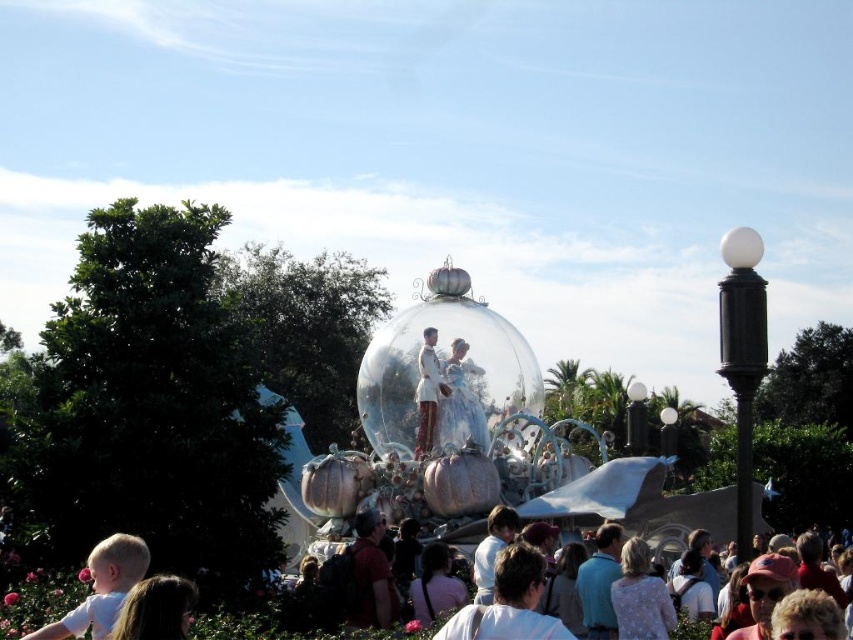
Who is more forward, (524,588) or (181,580)?

Point (181,580) is in front.

Can you confirm if white cotton shirt at center is positioned above blonde hair at lower left?

Incorrect, white cotton shirt at center is not positioned above blonde hair at lower left.

Locate an element on the screen. This screenshot has height=640, width=853. white cotton shirt at center is located at coordinates (508, 604).

Between point (486, 605) and point (425, 333), which one is positioned behind?

The point (425, 333) is more distant.

Based on the photo, who is more forward, (498,605) or (422,349)?

Point (498,605) is more forward.

Identify the location of white cotton shirt at center. (508, 604).

Which is more to the left, white cotton shirt at center or matte red backpack at center?

matte red backpack at center

The width and height of the screenshot is (853, 640). What do you see at coordinates (508, 604) in the screenshot?
I see `white cotton shirt at center` at bounding box center [508, 604].

Locate an element on the screen. The width and height of the screenshot is (853, 640). white cotton shirt at center is located at coordinates (508, 604).